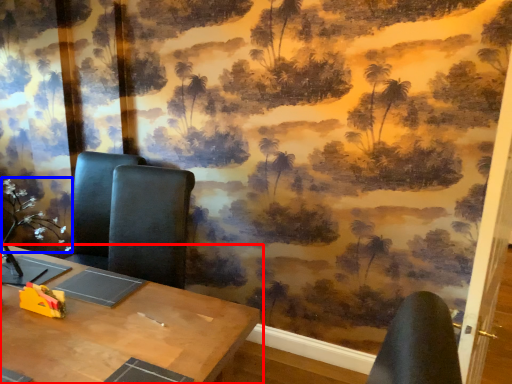
Question: Among these objects, which one is nearest to the camera, table (highlighted by a red box) or flower (highlighted by a blue box)?

Choices:
 (A) table
 (B) flower

Answer: (A)